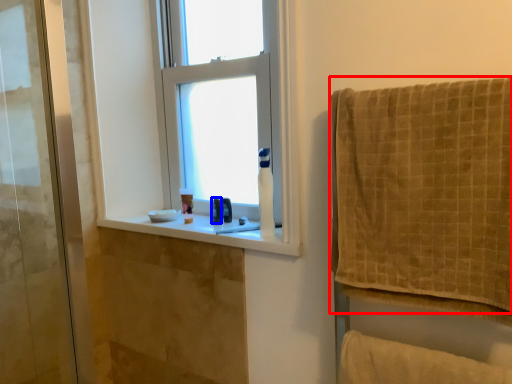
Question: Which object appears closest to the camera in this image, towel (highlighted by a red box) or toiletry (highlighted by a blue box)?

Choices:
 (A) towel
 (B) toiletry

Answer: (A)